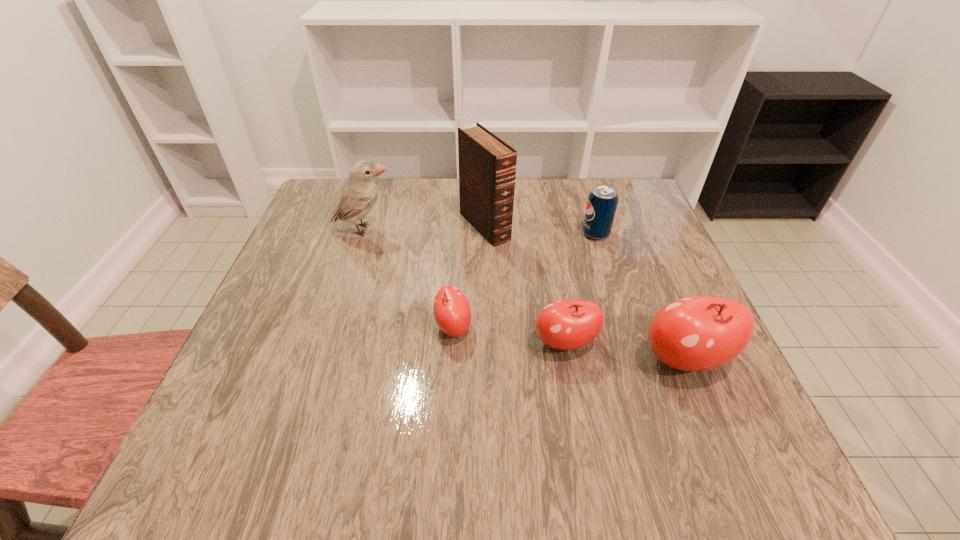
Where is `soda can at the right edge`? The image size is (960, 540). soda can at the right edge is located at coordinates (602, 202).

The width and height of the screenshot is (960, 540). I want to click on object present at the far left corner, so click(x=359, y=194).

You are a GUI agent. You are given a task and a screenshot of the screen. Output one action in this format:
    pyautogui.click(x=<x>, y=<y>)
    Task: Click on the object that is at the far right corner
    
    Given the screenshot: What is the action you would take?
    pyautogui.click(x=602, y=202)

Image resolution: width=960 pixels, height=540 pixels. Find the location of `object that is at the near right corner`. object that is at the near right corner is located at coordinates (696, 333).

The image size is (960, 540). In order to click on free space at the far edge of the desktop in this screenshot , I will do `click(455, 185)`.

The width and height of the screenshot is (960, 540). In the image, there is a desktop. In order to click on vacant space at the near edge in this screenshot , I will do `click(427, 402)`.

The image size is (960, 540). Identify the location of free location at the left edge. (277, 313).

Find the location of a particular element. free region at the right edge of the desktop is located at coordinates (619, 283).

Locate an element on the screen. The width and height of the screenshot is (960, 540). vacant area at the far left corner is located at coordinates (331, 196).

The image size is (960, 540). I want to click on free space at the near right corner, so click(646, 386).